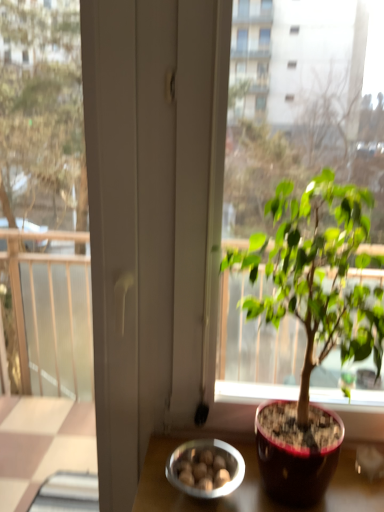
Find the location of a particular element. metallic silver bowl at lower center is located at coordinates point(200,465).

This screenshot has height=512, width=384. Describe the element at coordinates (200, 465) in the screenshot. I see `metallic silver bowl at lower center` at that location.

You are a GUI agent. You are given a task and a screenshot of the screen. Output one action in this format:
    pyautogui.click(x=<x>, y=<y>)
    Task: Click on the green glossy houseplant at center
    Image resolution: width=384 pixels, height=512 pixels.
    Given the screenshot: What is the action you would take?
    pyautogui.click(x=323, y=280)

This screenshot has width=384, height=512. Describe the element at coordinates (323, 280) in the screenshot. I see `green glossy houseplant at center` at that location.

Where is `metallic silver bowl at lower center`? Image resolution: width=384 pixels, height=512 pixels. metallic silver bowl at lower center is located at coordinates (200, 465).

Consider the image. Which is more to the left, metallic silver bowl at lower center or green glossy houseplant at center?

metallic silver bowl at lower center is more to the left.

Between metallic silver bowl at lower center and green glossy houseplant at center, which one is positioned in front?

green glossy houseplant at center is more forward.

Is point (173, 480) farther from viewer compared to point (291, 204)?

Yes, it is behind point (291, 204).

From the image's perspective, would you say metallic silver bowl at lower center is positioned over green glossy houseplant at center?

Actually, metallic silver bowl at lower center appears below green glossy houseplant at center in the image.

From a real-world perspective, is metallic silver bowl at lower center over green glossy houseplant at center?

Incorrect, from a real-world perspective, metallic silver bowl at lower center is lower than green glossy houseplant at center.

Can you confirm if metallic silver bowl at lower center is wider than green glossy houseplant at center?

No.

Considering the sizes of objects metallic silver bowl at lower center and green glossy houseplant at center in the image provided, who is shorter, metallic silver bowl at lower center or green glossy houseplant at center?

With less height is metallic silver bowl at lower center.

Does metallic silver bowl at lower center have a smaller size compared to green glossy houseplant at center?

Correct, metallic silver bowl at lower center occupies less space than green glossy houseplant at center.

Do you think metallic silver bowl at lower center is within green glossy houseplant at center, or outside of it?

metallic silver bowl at lower center is contained in green glossy houseplant at center.

Consider the image. Are metallic silver bowl at lower center and green glossy houseplant at center making contact?

They are not placed beside each other.

From the picture: Is metallic silver bowl at lower center facing away from green glossy houseplant at center?

No, green glossy houseplant at center is not at the back of metallic silver bowl at lower center.

What's the angular difference between metallic silver bowl at lower center and green glossy houseplant at center's facing directions?

The facing directions of metallic silver bowl at lower center and green glossy houseplant at center are 0.943 degrees apart.

The height and width of the screenshot is (512, 384). Identify the location of bowl directly beneath the green glossy houseplant at center (from a real-world perspective). (200, 465).

Which is more to the right, green glossy houseplant at center or metallic silver bowl at lower center?

green glossy houseplant at center.

Does green glossy houseplant at center lie in front of metallic silver bowl at lower center?

Yes, green glossy houseplant at center is closer to the camera.

Does point (353, 196) lie behind point (176, 482)?

No, (353, 196) is in front of (176, 482).

From the image's perspective, does green glossy houseplant at center appear lower than metallic silver bowl at lower center?

No.

From a real-world perspective, which object stands above the other?

green glossy houseplant at center is physically above.

Considering the sizes of green glossy houseplant at center and metallic silver bowl at lower center in the image, is green glossy houseplant at center wider or thinner than metallic silver bowl at lower center?

green glossy houseplant at center is wider than metallic silver bowl at lower center.

From their relative heights in the image, would you say green glossy houseplant at center is taller or shorter than metallic silver bowl at lower center?

green glossy houseplant at center is taller than metallic silver bowl at lower center.

Who is bigger, green glossy houseplant at center or metallic silver bowl at lower center?

green glossy houseplant at center.

Choose the correct answer: Is green glossy houseplant at center inside metallic silver bowl at lower center or outside it?

green glossy houseplant at center is spatially situated outside metallic silver bowl at lower center.

Are green glossy houseplant at center and metallic silver bowl at lower center far apart?

Actually, green glossy houseplant at center and metallic silver bowl at lower center are a little close together.

Is green glossy houseplant at center turned away from metallic silver bowl at lower center?

No, green glossy houseplant at center's orientation is not away from metallic silver bowl at lower center.

How different are the orientations of green glossy houseplant at center and metallic silver bowl at lower center in degrees?

The angular difference between green glossy houseplant at center and metallic silver bowl at lower center is 0.943 degrees.

Image resolution: width=384 pixels, height=512 pixels. In order to click on bowl below the green glossy houseplant at center (from the image's perspective) in this screenshot , I will do `click(200, 465)`.

Locate an element on the screen. This screenshot has width=384, height=512. bowl to the left of green glossy houseplant at center is located at coordinates (200, 465).

The image size is (384, 512). I want to click on houseplant located above the metallic silver bowl at lower center (from the image's perspective), so click(323, 280).